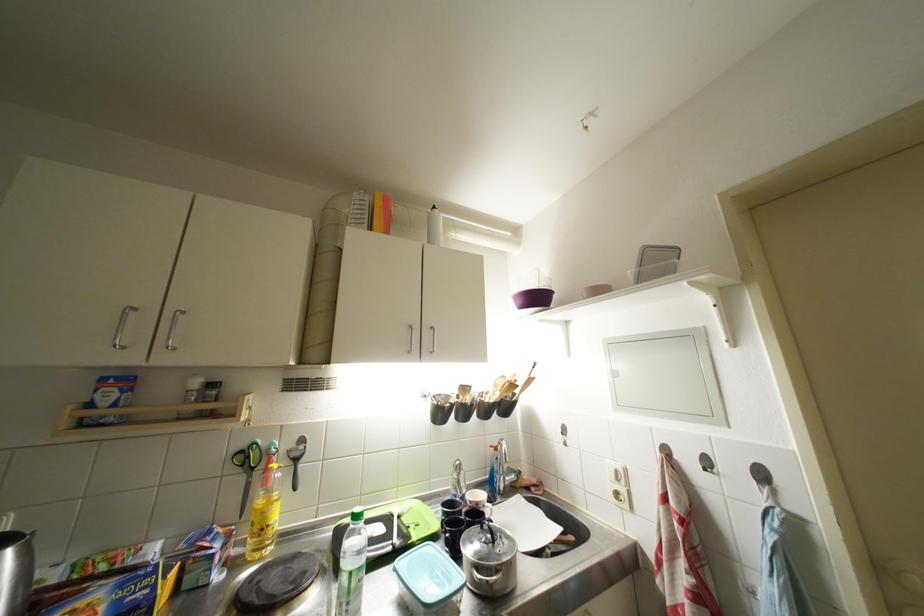
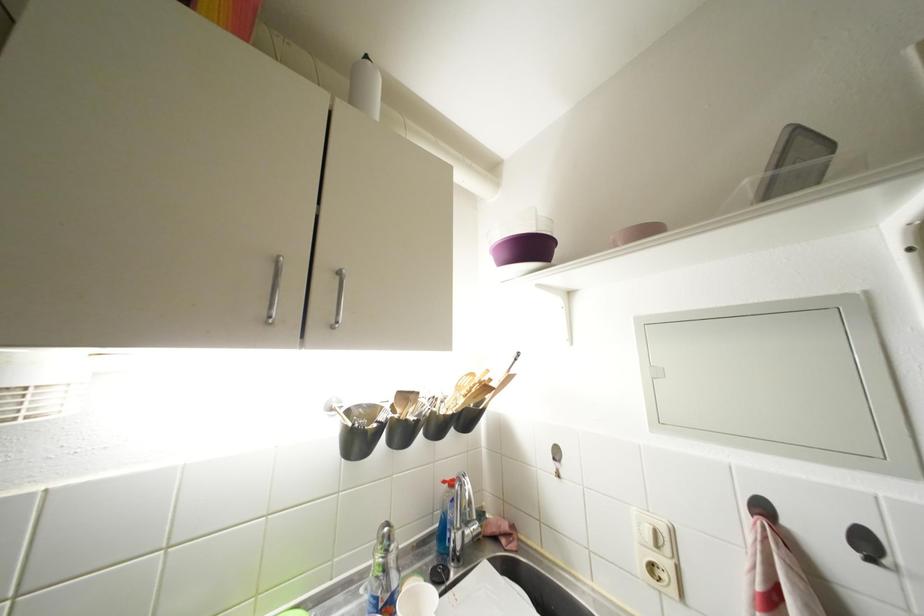
The point at (624,484) is marked in the first image. Where is the corresponding point in the second image?

(663, 549)